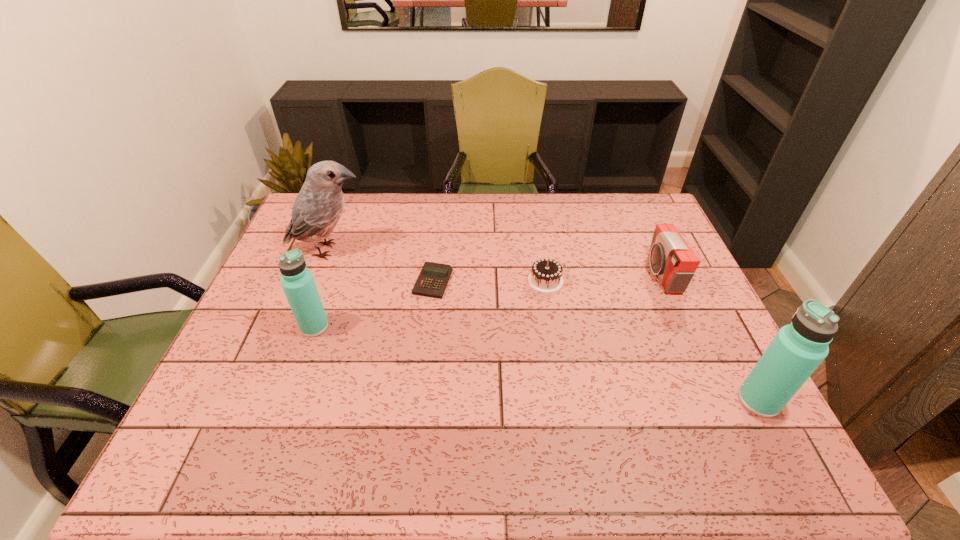
At what (x,y) coordinates should I click in order to perform the action: click on the farther thermos bottle. Please return your answer as a coordinate pair (x, y). The height and width of the screenshot is (540, 960). Looking at the image, I should click on (298, 284).

Where is `the second nearest object`? The image size is (960, 540). the second nearest object is located at coordinates (298, 284).

Where is `the right thermos bottle`? the right thermos bottle is located at coordinates (796, 351).

Where is `the nearer thermos bottle`? The image size is (960, 540). the nearer thermos bottle is located at coordinates (796, 351).

The width and height of the screenshot is (960, 540). Identify the location of chocolate cake. (546, 275).

At what (x,y) coordinates should I click in order to perform the action: click on the second shortest object. Please return your answer as a coordinate pair (x, y). Looking at the image, I should click on (546, 275).

Find the location of a particular element. This screenshot has width=960, height=540. camera is located at coordinates (671, 258).

In order to click on the fourth tallest object in this screenshot , I will do `click(671, 258)`.

Locate an element on the screen. This screenshot has width=960, height=540. the shortest object is located at coordinates (432, 281).

Identify the location of calculator. The image size is (960, 540). (432, 281).